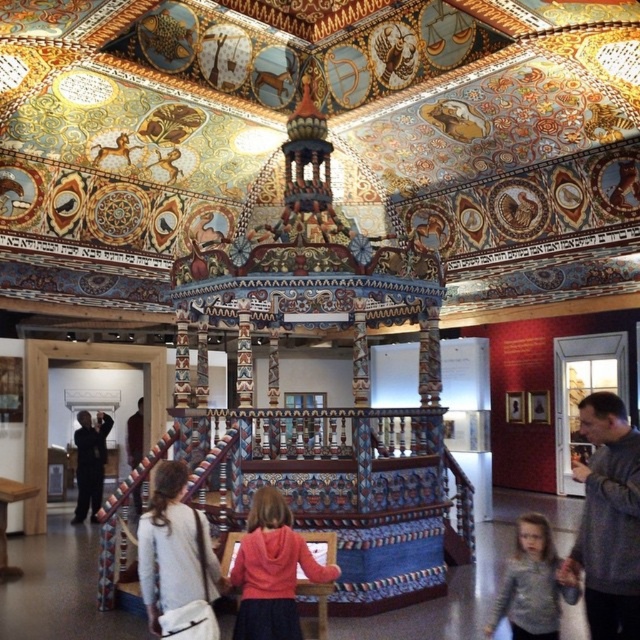
Can you confirm if white fabric bag at lower left is bigger than black matte suit at left?

No, white fabric bag at lower left is not bigger than black matte suit at left.

Is white fabric bag at lower left wider than black matte suit at left?

In fact, white fabric bag at lower left might be narrower than black matte suit at left.

Is point (168, 508) closer to camera compared to point (77, 416)?

Yes, it is.

Where is `white fabric bag at lower left`? white fabric bag at lower left is located at coordinates (177, 561).

Is white fabric bag at lower left closer to the viewer compared to gray sweater at lower right?

That is True.

Is white fabric bag at lower left behind gray sweater at lower right?

No, white fabric bag at lower left is in front of gray sweater at lower right.

Is point (202, 600) positioned in front of point (502, 580)?

Yes.

Where is `white fabric bag at lower left`? white fabric bag at lower left is located at coordinates (177, 561).

Between point (620, 486) and point (74, 435), which one is positioned in front?

Point (620, 486) is in front.

Does gray sweater at center have a greater width compared to black matte suit at left?

Correct, the width of gray sweater at center exceeds that of black matte suit at left.

The image size is (640, 640). What are the coordinates of `gray sweater at center` in the screenshot? It's located at (609, 518).

Locate an element on the screen. gray sweater at center is located at coordinates (609, 518).